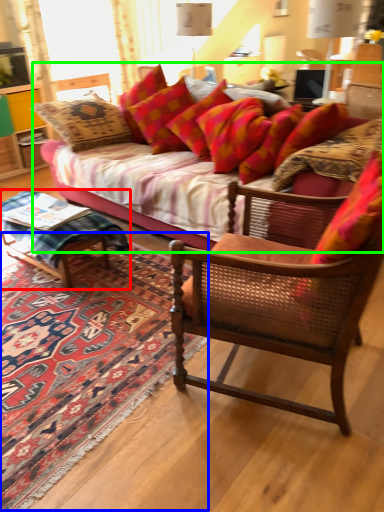
Question: Based on their relative distances, which object is farther from coffee table (highlighted by a red box)? Choose from mat (highlighted by a blue box) and studio couch (highlighted by a green box).

Choices:
 (A) mat
 (B) studio couch

Answer: (B)